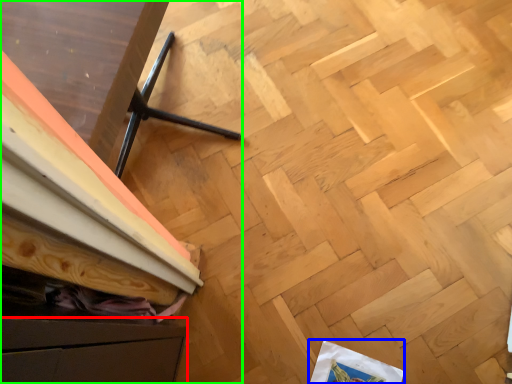
Question: Which object is positioned closest to drawer (highlighted by a red box)? Select from wrapping paper (highlighted by a blue box) and furniture (highlighted by a green box).

Choices:
 (A) wrapping paper
 (B) furniture

Answer: (B)